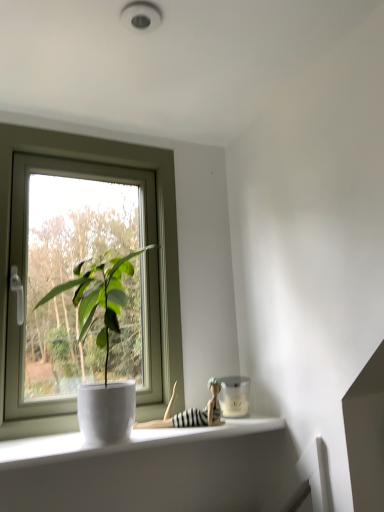
At what (x,y) coordinates should I click in order to perform the action: click on vacant area that is in front of striped fabric doll at lower center. Please return your answer as a coordinate pair (x, y). Looking at the image, I should click on (160, 435).